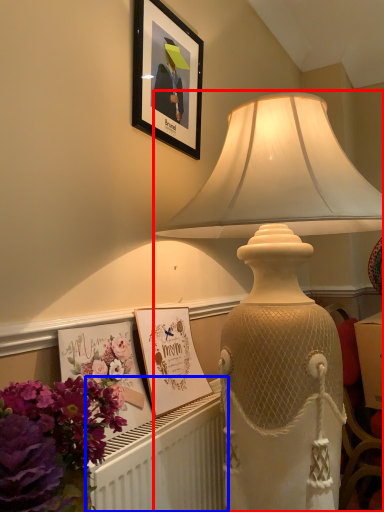
Question: Which object is closer to the camera taking this photo, lamp (highlighted by a red box) or radiator (highlighted by a blue box)?

Choices:
 (A) lamp
 (B) radiator

Answer: (A)